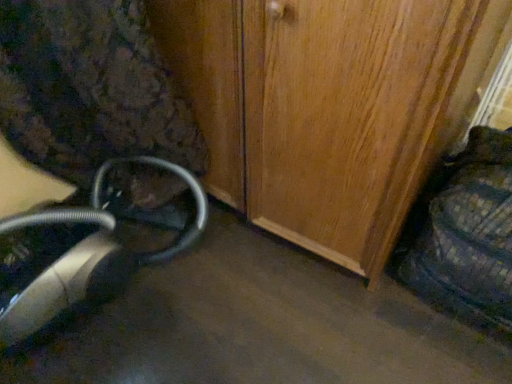
This screenshot has width=512, height=384. What do you see at coordinates (86, 257) in the screenshot?
I see `metallic silver vacuum cleaner at lower left` at bounding box center [86, 257].

Locate an element on the screen. metallic silver vacuum cleaner at lower left is located at coordinates (86, 257).

What is the approximate height of plaid fabric swivel chair at right?

It is 19.39 inches.

Image resolution: width=512 pixels, height=384 pixels. What do you see at coordinates (467, 234) in the screenshot?
I see `plaid fabric swivel chair at right` at bounding box center [467, 234].

Identify the location of plaid fabric swivel chair at right. This screenshot has width=512, height=384. (467, 234).

Identify the location of metallic silver vacuum cleaner at lower left. Image resolution: width=512 pixels, height=384 pixels. (86, 257).

Considering the relative positions of plaid fabric swivel chair at right and metallic silver vacuum cleaner at lower left in the image provided, is plaid fabric swivel chair at right to the right of metallic silver vacuum cleaner at lower left from the viewer's perspective?

Correct, you'll find plaid fabric swivel chair at right to the right of metallic silver vacuum cleaner at lower left.

Which object is closer to the camera, plaid fabric swivel chair at right or metallic silver vacuum cleaner at lower left?

plaid fabric swivel chair at right is in front.

From the picture: Which point is more forward, [483,187] or [11,312]?

The point [483,187] is in front.

From the image's perspective, is plaid fabric swivel chair at right positioned above or below metallic silver vacuum cleaner at lower left?

Clearly, from the image's perspective, plaid fabric swivel chair at right is above metallic silver vacuum cleaner at lower left.

From a real-world perspective, which is physically above, plaid fabric swivel chair at right or metallic silver vacuum cleaner at lower left?

In real-world perspective, plaid fabric swivel chair at right is above.

Can you confirm if plaid fabric swivel chair at right is wider than metallic silver vacuum cleaner at lower left?

Yes.

In terms of height, does plaid fabric swivel chair at right look taller or shorter compared to metallic silver vacuum cleaner at lower left?

plaid fabric swivel chair at right is taller than metallic silver vacuum cleaner at lower left.

Considering the relative sizes of plaid fabric swivel chair at right and metallic silver vacuum cleaner at lower left in the image provided, is plaid fabric swivel chair at right bigger than metallic silver vacuum cleaner at lower left?

Incorrect, plaid fabric swivel chair at right is not larger than metallic silver vacuum cleaner at lower left.

Looking at this image, do you think plaid fabric swivel chair at right is within metallic silver vacuum cleaner at lower left, or outside of it?

plaid fabric swivel chair at right is not inside metallic silver vacuum cleaner at lower left, it's outside.

Is plaid fabric swivel chair at right not near metallic silver vacuum cleaner at lower left?

No, plaid fabric swivel chair at right is in close proximity to metallic silver vacuum cleaner at lower left.

Could you tell me if plaid fabric swivel chair at right is turned towards metallic silver vacuum cleaner at lower left?

No.

Measure the distance between plaid fabric swivel chair at right and metallic silver vacuum cleaner at lower left.

They are 29.07 inches apart.

Where is `swivel chair lying on the right of metallic silver vacuum cleaner at lower left`? The height and width of the screenshot is (384, 512). swivel chair lying on the right of metallic silver vacuum cleaner at lower left is located at coordinates (467, 234).

Between metallic silver vacuum cleaner at lower left and plaid fabric swivel chair at right, which one appears on the left side from the viewer's perspective?

Positioned to the left is metallic silver vacuum cleaner at lower left.

Considering their positions, is metallic silver vacuum cleaner at lower left located in front of or behind plaid fabric swivel chair at right?

Visually, metallic silver vacuum cleaner at lower left is located behind plaid fabric swivel chair at right.

Is point (62, 278) positioned before point (419, 254)?

Yes.

From the image's perspective, is metallic silver vacuum cleaner at lower left positioned above or below plaid fabric swivel chair at right?

metallic silver vacuum cleaner at lower left is situated lower than plaid fabric swivel chair at right in the image.

Looking at this image, from a real-world perspective, which is physically above, metallic silver vacuum cleaner at lower left or plaid fabric swivel chair at right?

In real-world perspective, plaid fabric swivel chair at right is above.

Between metallic silver vacuum cleaner at lower left and plaid fabric swivel chair at right, which one has larger width?

Wider between the two is plaid fabric swivel chair at right.

Considering the sizes of objects metallic silver vacuum cleaner at lower left and plaid fabric swivel chair at right in the image provided, who is shorter, metallic silver vacuum cleaner at lower left or plaid fabric swivel chair at right?

Standing shorter between the two is metallic silver vacuum cleaner at lower left.

Considering the relative sizes of metallic silver vacuum cleaner at lower left and plaid fabric swivel chair at right in the image provided, is metallic silver vacuum cleaner at lower left smaller than plaid fabric swivel chair at right?

No.

Does metallic silver vacuum cleaner at lower left contain plaid fabric swivel chair at right?

Definitely not — plaid fabric swivel chair at right is not inside metallic silver vacuum cleaner at lower left.

Is metallic silver vacuum cleaner at lower left directly adjacent to plaid fabric swivel chair at right?

No, metallic silver vacuum cleaner at lower left is not with plaid fabric swivel chair at right.

Is metallic silver vacuum cleaner at lower left oriented away from plaid fabric swivel chair at right?

No.

Locate an element on the screen. The image size is (512, 384). swivel chair that is above the metallic silver vacuum cleaner at lower left (from a real-world perspective) is located at coordinates (467, 234).

This screenshot has width=512, height=384. Find the location of `swivel chair in front of the metallic silver vacuum cleaner at lower left`. swivel chair in front of the metallic silver vacuum cleaner at lower left is located at coordinates (467, 234).

This screenshot has width=512, height=384. Find the location of `equipment lying on the left of plaid fabric swivel chair at right`. equipment lying on the left of plaid fabric swivel chair at right is located at coordinates point(86,257).